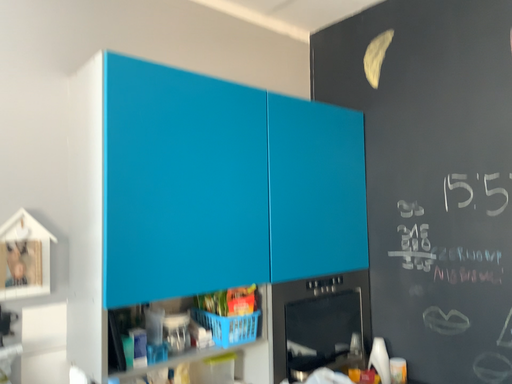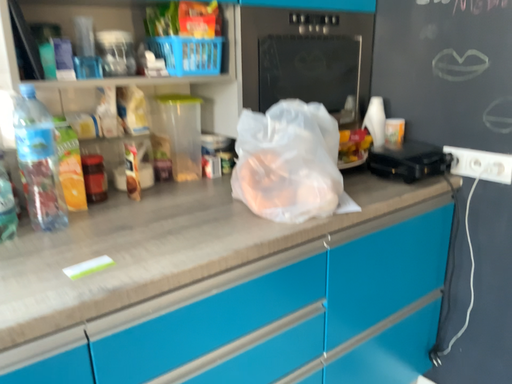
Question: How did the camera likely rotate when shooting the video?

Choices:
 (A) rotated upward
 (B) rotated downward

Answer: (B)